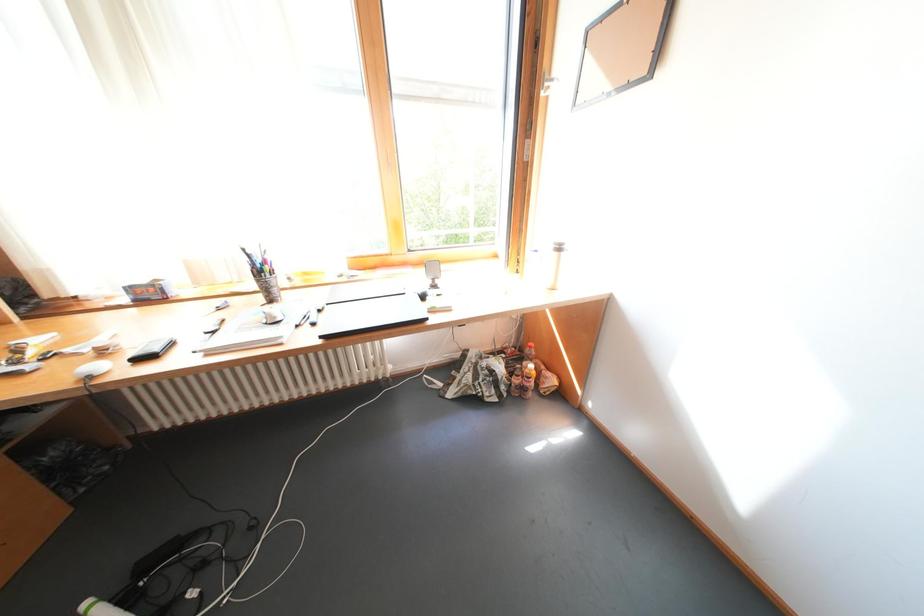
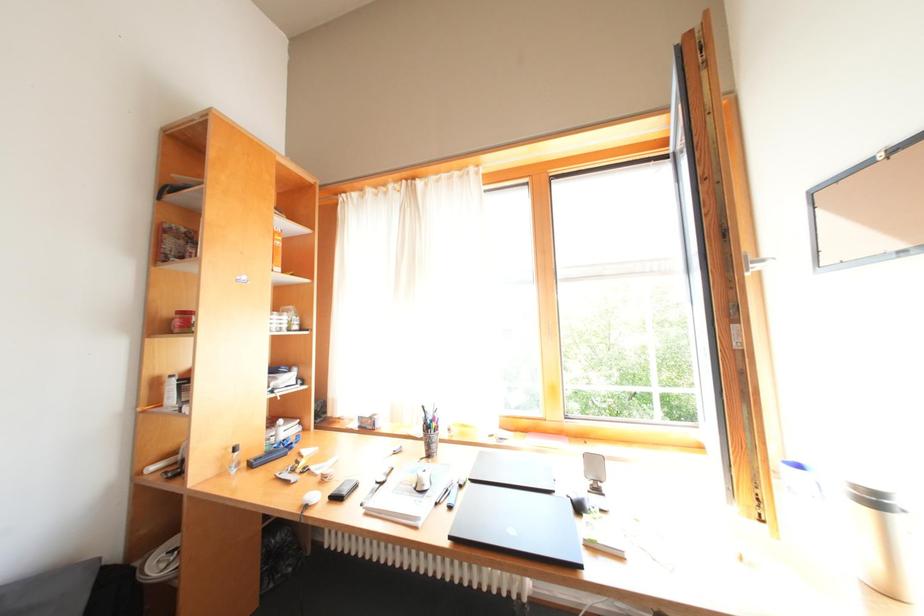
Based on the photo, the images are taken continuously from a first-person perspective. In which direction is your viewpoint rotating?

The camera rotated toward left-up.